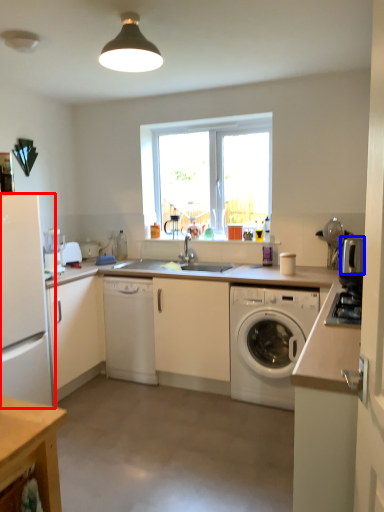
Question: Which of the following is the closest to the observer, refrigerator (highlighted by a red box) or appliance (highlighted by a blue box)?

Choices:
 (A) refrigerator
 (B) appliance

Answer: (A)